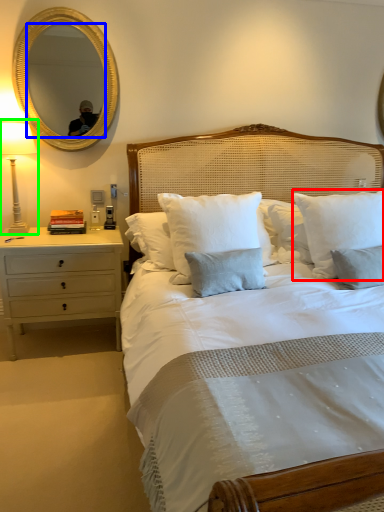
Question: Which object is positioned closest to pillow (highlighted by a red box)? Select from mirror (highlighted by a blue box) and bedside lamp (highlighted by a green box).

Choices:
 (A) mirror
 (B) bedside lamp

Answer: (A)